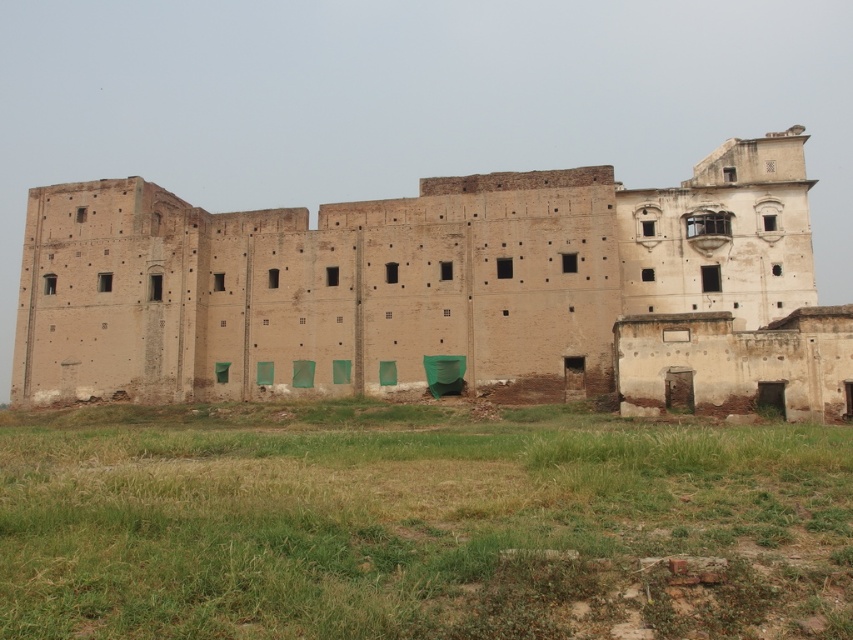
Question: Is green grass at lower center positioned before beige brick ruins at center?

Choices:
 (A) no
 (B) yes

Answer: (B)

Question: Which object is farther from the camera taking this photo?

Choices:
 (A) green grass at lower center
 (B) beige brick ruins at center

Answer: (B)

Question: Does green grass at lower center have a smaller size compared to beige brick ruins at center?

Choices:
 (A) no
 (B) yes

Answer: (B)

Question: Among these points, which one is farthest from the camera?

Choices:
 (A) (521, 557)
 (B) (235, 308)

Answer: (B)

Question: Can you confirm if green grass at lower center is positioned to the right of beige brick ruins at center?

Choices:
 (A) yes
 (B) no

Answer: (B)

Question: Which of the following is the closest to the observer?

Choices:
 (A) green grass at lower center
 (B) beige brick ruins at center

Answer: (A)